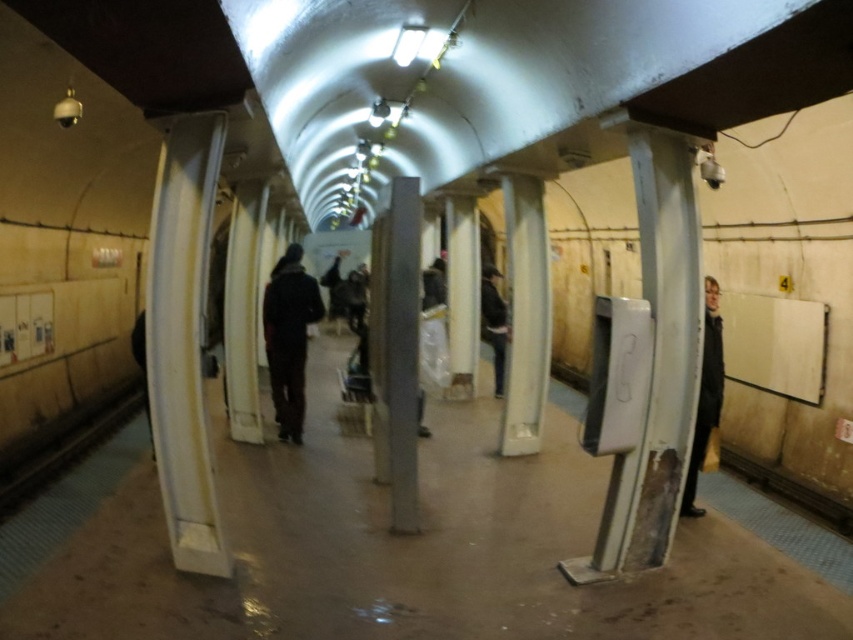
Question: Is black leather jacket at right positioned before dark brown leather jacket at center?

Choices:
 (A) no
 (B) yes

Answer: (B)

Question: Does dark gray fabric jacket at center have a smaller size compared to dark brown leather jacket at center?

Choices:
 (A) no
 (B) yes

Answer: (B)

Question: Which object appears farthest from the camera in this image?

Choices:
 (A) black leather jacket at right
 (B) dark gray fabric jacket at center
 (C) dark brown leather jacket at center

Answer: (C)

Question: Which point is closer to the camera taking this photo?

Choices:
 (A) (506, 310)
 (B) (296, 310)

Answer: (B)

Question: Estimate the real-world distances between objects in this image. Which object is farther from the dark gray fabric jacket at center?

Choices:
 (A) black leather jacket at right
 (B) dark brown leather jacket at center

Answer: (A)

Question: From the image, what is the correct spatial relationship of dark gray fabric jacket at center in relation to black leather jacket at right?

Choices:
 (A) below
 (B) above

Answer: (B)